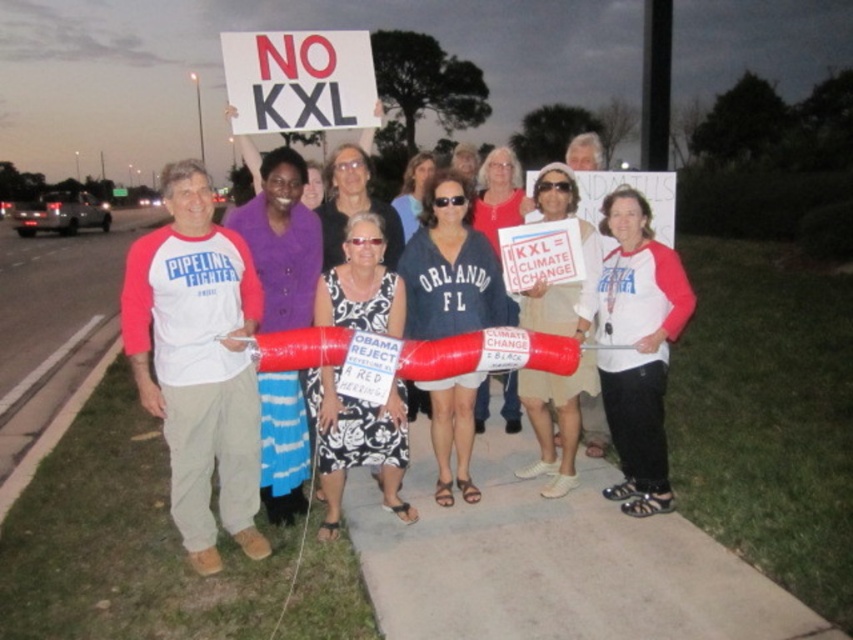
Question: Which point is closer to the camera taking this photo?

Choices:
 (A) pyautogui.click(x=560, y=205)
 (B) pyautogui.click(x=491, y=180)
 (C) pyautogui.click(x=413, y=228)

Answer: (A)

Question: Does black printed dress at center have a larger size compared to beige fabric dress at center?

Choices:
 (A) yes
 (B) no

Answer: (B)

Question: Which of the following is the farthest from the observer?

Choices:
 (A) purple fabric dress at center
 (B) matte black shirt at center
 (C) white paper sign at center
 (D) matte black tank top at center

Answer: (D)

Question: In this image, where is concrete at center located relative to white matte t-shirt at center?

Choices:
 (A) left
 (B) right

Answer: (A)

Question: Which point appears farthest from the camera in this image?

Choices:
 (A) (434, 241)
 (B) (410, 228)
 (C) (397, 310)
 (D) (577, 220)

Answer: (B)

Question: Does black printed dress at center lie in front of matte white shirt at center?

Choices:
 (A) no
 (B) yes

Answer: (B)